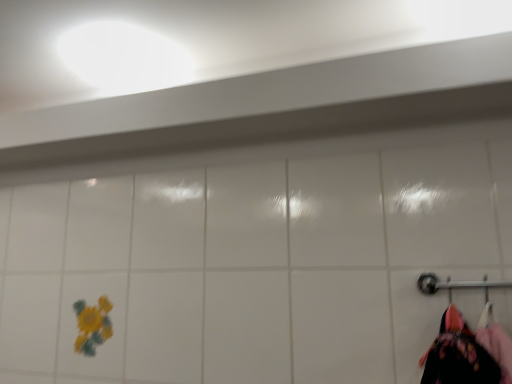
What do you see at coordinates (454, 284) in the screenshot?
I see `chrome metallic door handle at right` at bounding box center [454, 284].

What are the coordinates of `chrome metallic door handle at right` in the screenshot? It's located at (454, 284).

Consider the image. In order to face chrome metallic door handle at right, should I rotate leftwards or rightwards?

Turn right approximately 30.314 degrees to face it.

At what (x,y) coordinates should I click in order to perform the action: click on chrome metallic door handle at right. Please return your answer as a coordinate pair (x, y). This screenshot has width=512, height=384. Looking at the image, I should click on (454, 284).